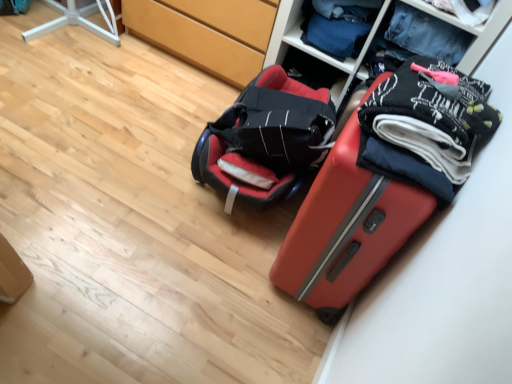
Question: From the image's perspective, is matte red suitcase at lower right located above matte wood cabinet at center?

Choices:
 (A) no
 (B) yes

Answer: (A)

Question: Does matte red suitcase at lower right have a lesser width compared to matte wood cabinet at center?

Choices:
 (A) yes
 (B) no

Answer: (A)

Question: Is matte red suitcase at lower right bigger than matte wood cabinet at center?

Choices:
 (A) no
 (B) yes

Answer: (A)

Question: Is matte wood cabinet at center at the back of matte red suitcase at lower right?

Choices:
 (A) yes
 (B) no

Answer: (B)

Question: Does matte red suitcase at lower right have a smaller size compared to matte wood cabinet at center?

Choices:
 (A) no
 (B) yes

Answer: (B)

Question: In the image, is textured fabric clothes at upper right on the left side or the right side of matte wood cabinet at center?

Choices:
 (A) left
 (B) right

Answer: (B)

Question: Is textured fabric clothes at upper right in front of or behind matte wood cabinet at center in the image?

Choices:
 (A) behind
 (B) front

Answer: (B)

Question: Is textured fabric clothes at upper right situated inside matte wood cabinet at center or outside?

Choices:
 (A) inside
 (B) outside

Answer: (B)

Question: Is point (285, 34) positioned closer to the camera than point (243, 48)?

Choices:
 (A) closer
 (B) farther

Answer: (A)

Question: In the image, is denim jeans at upper right, which ranks as the second clothing in bottom-to-top order, positioned in front of or behind black cotton socks at upper right, which ranks as the 2th clothing in top-to-bottom order?

Choices:
 (A) front
 (B) behind

Answer: (B)

Question: Is denim jeans at upper right, which ranks as the second clothing in bottom-to-top order, inside the boundaries of black cotton socks at upper right, the first clothing from the front, or outside?

Choices:
 (A) inside
 (B) outside

Answer: (B)

Question: From a real-world perspective, is denim jeans at upper right, the second clothing in the front-to-back sequence, physically located above or below black cotton socks at upper right, the first clothing from the front?

Choices:
 (A) below
 (B) above

Answer: (A)

Question: Is denim jeans at upper right, placed as the 1th clothing when sorted from back to front, bigger or smaller than black cotton socks at upper right, the first clothing from the front?

Choices:
 (A) small
 (B) big

Answer: (A)

Question: From the image's perspective, relative to textured fabric clothes at upper right, is matte red suitcase at lower right above or below?

Choices:
 (A) below
 (B) above

Answer: (A)

Question: Is matte red suitcase at lower right to the left or to the right of textured fabric clothes at upper right in the image?

Choices:
 (A) left
 (B) right

Answer: (A)